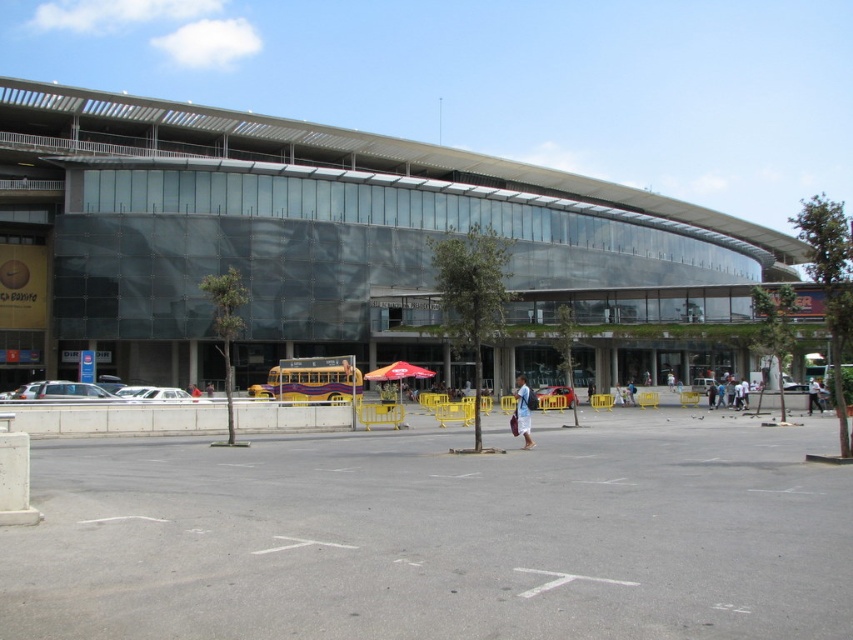
Question: Considering the real-world distances, which object is closest to the blue fabric bag at center?

Choices:
 (A) white fabric bag at center
 (B) gray asphalt parking lot at center
 (C) transparent glass building at center

Answer: (B)

Question: Estimate the real-world distances between objects in this image. Which object is closer to the gray asphalt parking lot at center?

Choices:
 (A) blue fabric bag at center
 (B) transparent glass building at center
 (C) white fabric bag at center

Answer: (A)

Question: From the image, what is the correct spatial relationship of transparent glass building at center in relation to white fabric bag at center?

Choices:
 (A) below
 (B) above

Answer: (B)

Question: Is transparent glass building at center smaller than blue fabric bag at center?

Choices:
 (A) yes
 (B) no

Answer: (B)

Question: Can you confirm if gray asphalt parking lot at center is positioned above white fabric bag at center?

Choices:
 (A) no
 (B) yes

Answer: (B)

Question: Which object is closer to the camera taking this photo?

Choices:
 (A) white fabric bag at center
 (B) transparent glass building at center
 (C) blue fabric bag at center

Answer: (C)